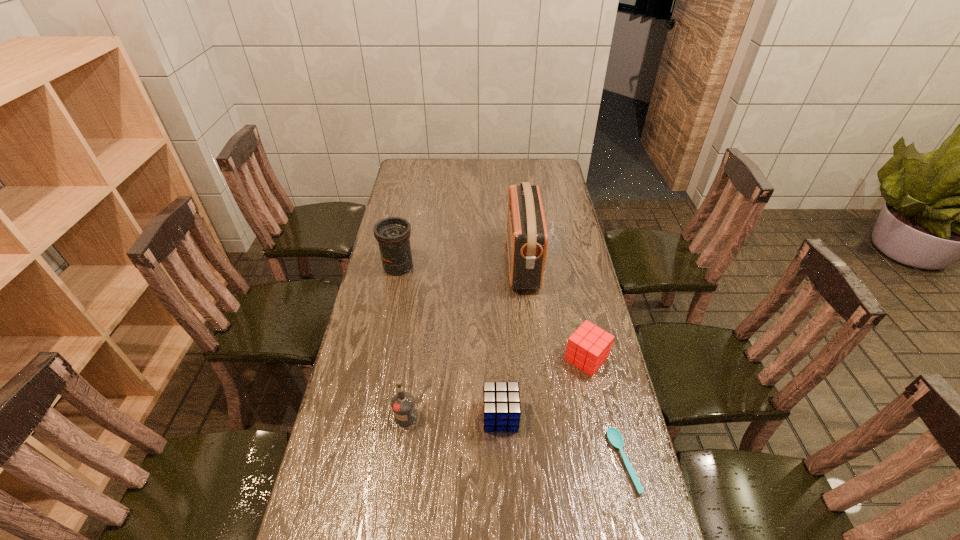
Find the location of a particular element. The image size is (960, 540). the third object from right to left is located at coordinates (527, 238).

Where is `radio receiver`? This screenshot has height=540, width=960. radio receiver is located at coordinates (527, 238).

Where is `telephoto lens`? The width and height of the screenshot is (960, 540). telephoto lens is located at coordinates (393, 234).

Where is `the fifth object from right to left`? The height and width of the screenshot is (540, 960). the fifth object from right to left is located at coordinates (403, 403).

Where is `the farther cube`? the farther cube is located at coordinates (588, 348).

Where is `the fourth nearest object`? The image size is (960, 540). the fourth nearest object is located at coordinates (588, 348).

The image size is (960, 540). Find the location of `the nearer cube`. the nearer cube is located at coordinates (501, 400).

Identify the location of the fourth object from right to left. The width and height of the screenshot is (960, 540). (501, 400).

Find the location of `the shortest object`. the shortest object is located at coordinates (614, 436).

I want to click on free location located on the front-facing side of the radio receiver, so click(425, 262).